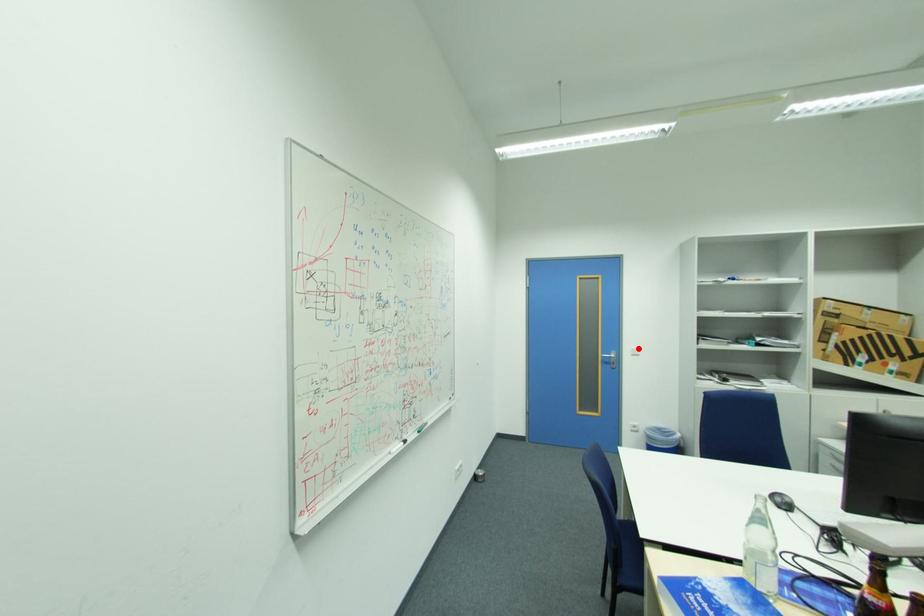
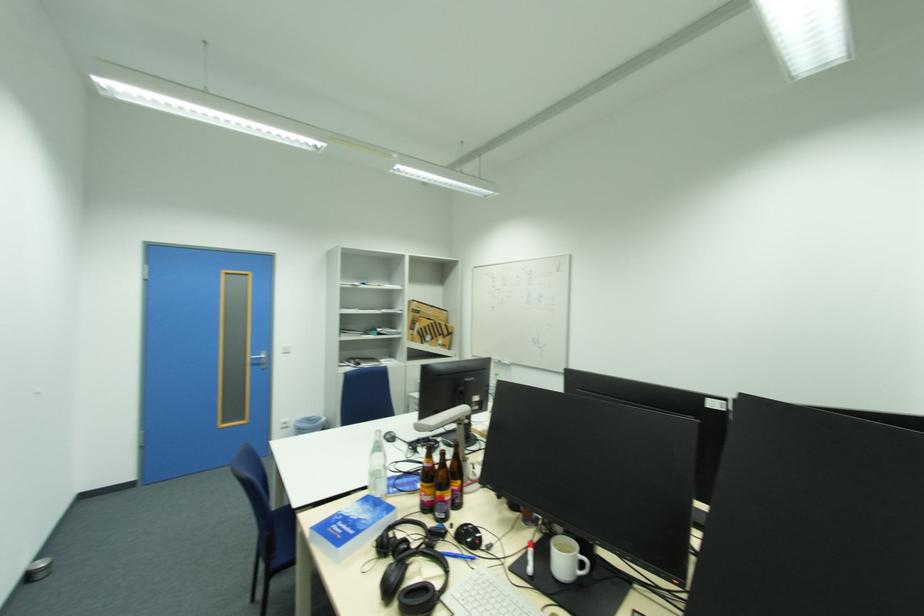
Where in the second image is the point corresponding to the highlighted location from the first image?

(289, 347)